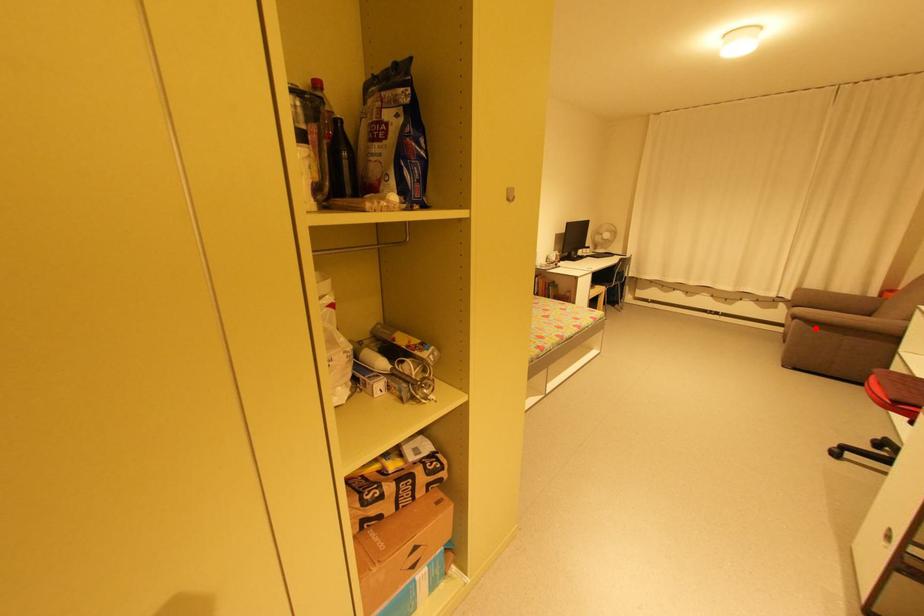
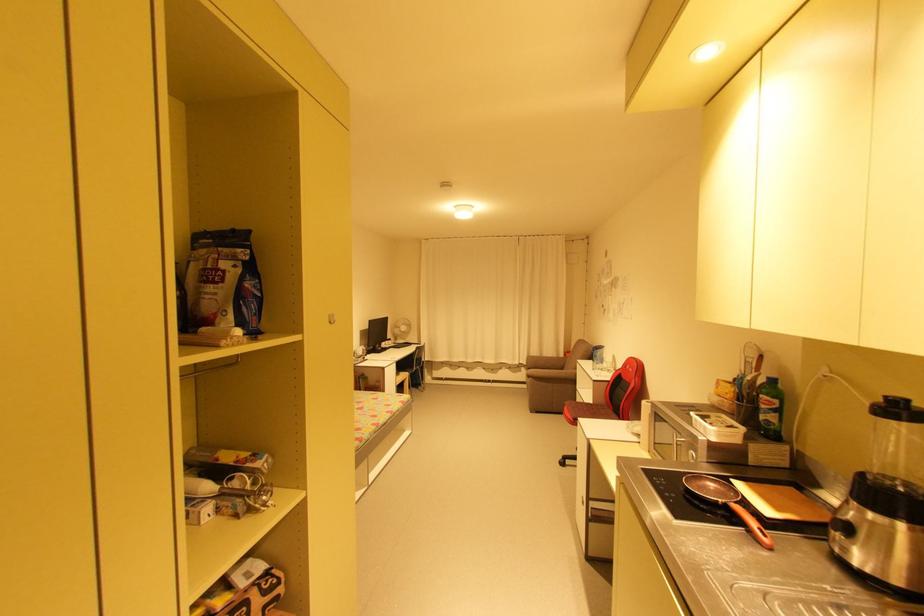
Find the pixel in the second image that matches the highlighted location in the first image.

(542, 383)